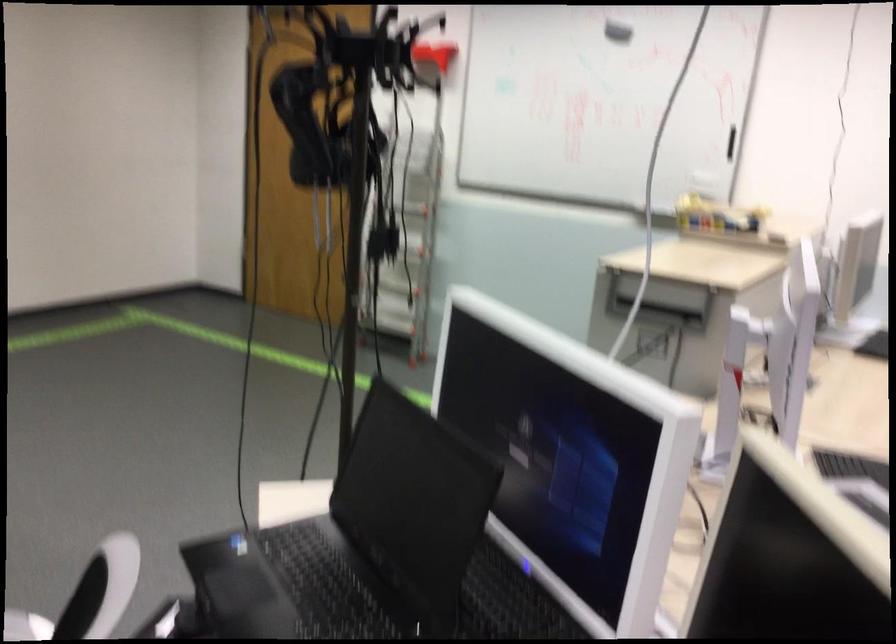
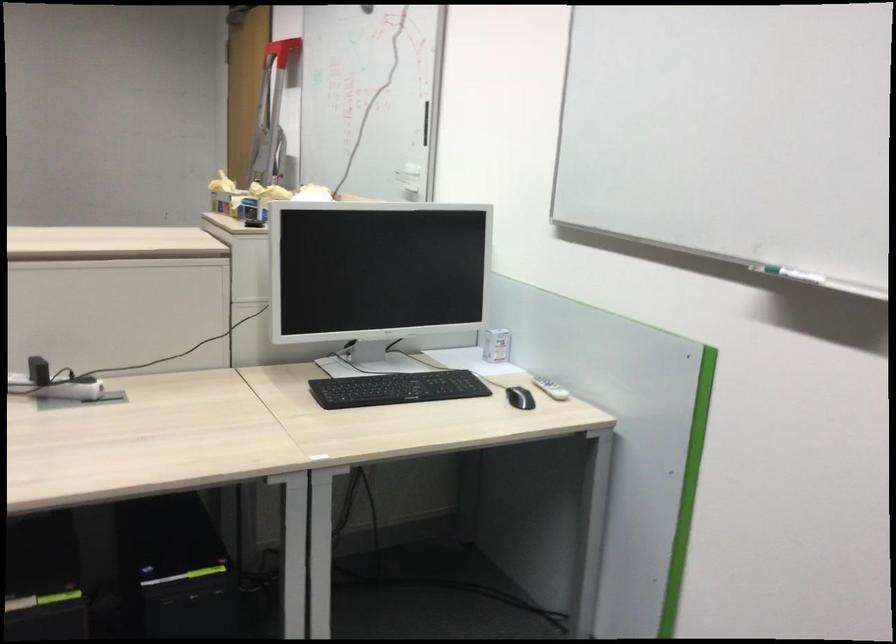
In the second image, find the point that corresponds to the point at 731,140 in the first image.

(426, 122)